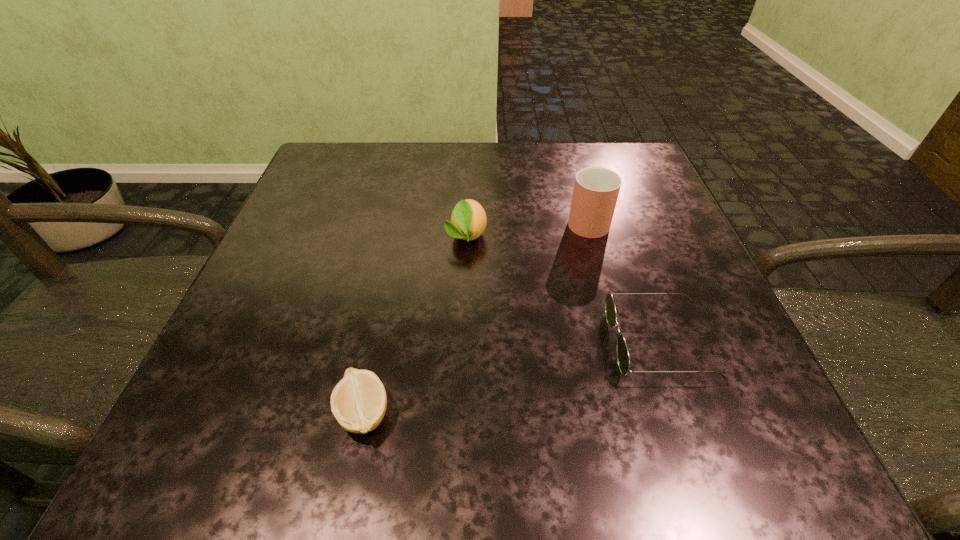
Where is `vacant region between the shorter lemon and the cup`? vacant region between the shorter lemon and the cup is located at coordinates (475, 316).

Locate an element on the screen. The width and height of the screenshot is (960, 540). vacant point located between the second object from left to right and the cup is located at coordinates (527, 227).

This screenshot has width=960, height=540. Find the location of `empty location between the sunglasses and the left lemon`. empty location between the sunglasses and the left lemon is located at coordinates (511, 378).

This screenshot has height=540, width=960. In order to click on free point between the tallest object and the taller lemon in this screenshot , I will do `click(527, 227)`.

Select which object is the third closest to the sunglasses. Please provide its 2D coordinates. Your answer should be formatted as a tuple, i.e. [(x, y)], where the tuple contains the x and y coordinates of a point satisfying the conditions above.

[(358, 402)]

Select which object appears as the closest to the right lemon. Please provide its 2D coordinates. Your answer should be formatted as a tuple, i.e. [(x, y)], where the tuple contains the x and y coordinates of a point satisfying the conditions above.

[(596, 189)]